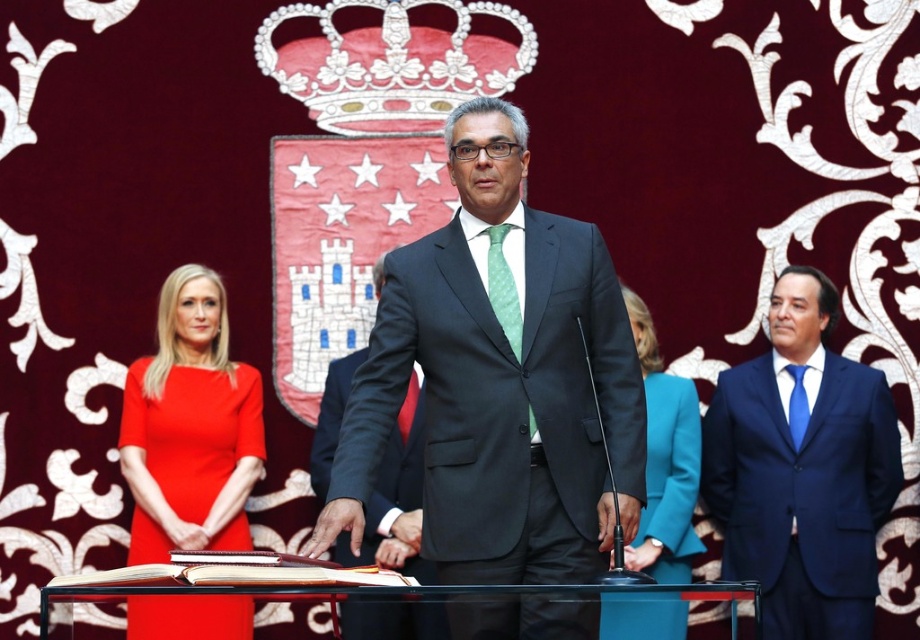
You are an event photographer at the ceremony. You need to capture a closeup shot of both the green silk tie at center and the green matte tie at center. Which tie will appear taller in the photo?

The green silk tie at center will appear taller in the photo because it has a greater height compared to the green matte tie at center.

You are an event organizer and need to determine the order of speakers based on their attire. The speaker wearing the matte black suit at center is standing where in relation to the teal fabric jacket at lower center?

The matte black suit at center is positioned over the teal fabric jacket at lower center, meaning the speaker in the matte black suit is standing in front of the teal fabric jacket wearer, so they should speak first according to the order.